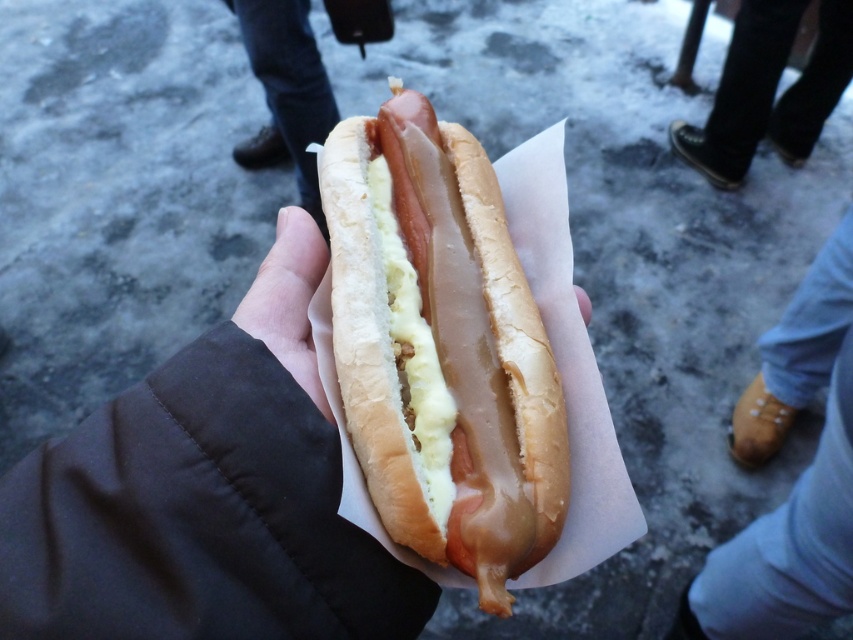
You are standing in a snowy area and see a hot dog in a paper wrapper being held by a hand. There is a point marked at coordinate (798,477) which corresponds to a brown leather shoe at lower right. If you want to place a small gift box near the brown leather shoe at lower right without blocking the hot dog, where should you position it relative to the hot dog?

The point marked at coordinate (798,477) indicates the location of the brown leather shoe at lower right. To place a small gift box near it without blocking the hot dog, position it to the lower right side of the hot dog, aligning with the brown leather shoe at lower right.